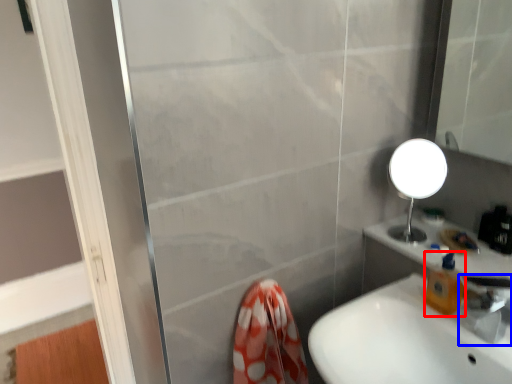
Question: Which point is further to the camera, soap dispenser (highlighted by a red box) or tap (highlighted by a blue box)?

Choices:
 (A) soap dispenser
 (B) tap

Answer: (A)